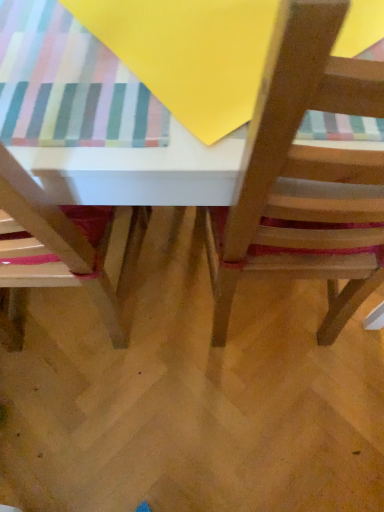
I want to click on wooden table at center, so click(306, 170).

This screenshot has height=512, width=384. What are the coordinates of `wooden chair at center, which is the first chair in right-to-left order` in the screenshot? It's located at (304, 176).

You are a GUI agent. You are given a task and a screenshot of the screen. Output one action in this format:
    pyautogui.click(x=<x>, y=<y>)
    Task: Click on the wooden chair at lower left, which appears as the 1th chair when viewed from the left
    The image size is (384, 512).
    Given the screenshot: What is the action you would take?
    pyautogui.click(x=61, y=246)

Locate an element on the screen. The height and width of the screenshot is (512, 384). wooden table at center is located at coordinates (306, 170).

Is wooden chair at lower left, which appears as the 1th chair when viewed from the left, inside wooden chair at center, which is the first chair in right-to-left order?

No, wooden chair at lower left, which appears as the 1th chair when viewed from the left, is not surrounded by wooden chair at center, which is the first chair in right-to-left order.

From the picture: Is wooden chair at center, which is the first chair in right-to-left order, oriented away from wooden chair at lower left, which appears as the 1th chair when viewed from the left?

No.

Can you confirm if wooden chair at center, which is the first chair in right-to-left order, is smaller than wooden chair at lower left, which is the second chair in right-to-left order?

No.

Which of these two, wooden table at center or wooden chair at center, which is the first chair in right-to-left order, stands shorter?

wooden table at center is shorter.

Is wooden table at center in front of or behind wooden chair at center, which is the first chair in right-to-left order, in the image?

In the image, wooden table at center appears behind wooden chair at center, which is the first chair in right-to-left order.

Consider the image. Is wooden table at center not within wooden chair at center, placed as the second chair when sorted from left to right?

Absolutely, wooden table at center is external to wooden chair at center, placed as the second chair when sorted from left to right.

Based on their sizes in the image, would you say wooden table at center is bigger or smaller than wooden chair at center, placed as the second chair when sorted from left to right?

Clearly, wooden table at center is larger in size than wooden chair at center, placed as the second chair when sorted from left to right.

Which object is closer to the camera taking this photo, wooden chair at center, placed as the second chair when sorted from left to right, or wooden table at center?

wooden chair at center, placed as the second chair when sorted from left to right, is closer to the camera.

From a real-world perspective, between wooden chair at center, which is the first chair in right-to-left order, and wooden table at center, who is vertically lower?

From a 3D spatial view, wooden table at center is below.

Considering the sizes of wooden chair at center, placed as the second chair when sorted from left to right, and wooden table at center in the image, is wooden chair at center, placed as the second chair when sorted from left to right, wider or thinner than wooden table at center?

Clearly, wooden chair at center, placed as the second chair when sorted from left to right, has less width compared to wooden table at center.

Is wooden chair at center, which is the first chair in right-to-left order, far away from wooden table at center?

That's not correct — wooden chair at center, which is the first chair in right-to-left order, is a little close to wooden table at center.

From the image's perspective, is wooden chair at lower left, which appears as the 1th chair when viewed from the left, above or below wooden chair at center, placed as the second chair when sorted from left to right?

wooden chair at lower left, which appears as the 1th chair when viewed from the left, is situated lower than wooden chair at center, placed as the second chair when sorted from left to right, in the image.

Is wooden chair at lower left, which is the second chair in right-to-left order, closer to the viewer compared to wooden chair at center, placed as the second chair when sorted from left to right?

No, wooden chair at lower left, which is the second chair in right-to-left order, is further to the viewer.

Considering the positions of points (8, 269) and (344, 270), is point (8, 269) farther from camera compared to point (344, 270)?

No, it is in front of (344, 270).

Looking at this image, between wooden chair at lower left, which is the second chair in right-to-left order, and wooden table at center, which one has larger width?

wooden table at center is wider.

From a real-world perspective, does wooden chair at lower left, which appears as the 1th chair when viewed from the left, stand above wooden table at center?

Yes, from a real-world perspective, wooden chair at lower left, which appears as the 1th chair when viewed from the left, is over wooden table at center

Who is bigger, wooden chair at lower left, which is the second chair in right-to-left order, or wooden table at center?

Bigger between the two is wooden table at center.

Does point (40, 193) appear closer or farther from the camera than point (377, 95)?

Clearly, point (40, 193) is more distant from the camera than point (377, 95).

How many degrees apart are the facing directions of wooden table at center and wooden chair at lower left, which appears as the 1th chair when viewed from the left?

0.000159 degrees.

Is wooden table at center smaller than wooden chair at lower left, which appears as the 1th chair when viewed from the left?

No, wooden table at center is not smaller than wooden chair at lower left, which appears as the 1th chair when viewed from the left.

Considering the sizes of wooden table at center and wooden chair at lower left, which appears as the 1th chair when viewed from the left, in the image, is wooden table at center wider or thinner than wooden chair at lower left, which appears as the 1th chair when viewed from the left,?

In the image, wooden table at center appears to be wider than wooden chair at lower left, which appears as the 1th chair when viewed from the left.

Consider the image. Would you say wooden table at center is inside or outside wooden chair at lower left, which appears as the 1th chair when viewed from the left?

wooden table at center is located beyond the bounds of wooden chair at lower left, which appears as the 1th chair when viewed from the left.

This screenshot has height=512, width=384. In order to click on chair that appears in front of the wooden chair at lower left, which is the second chair in right-to-left order in this screenshot , I will do `click(304, 176)`.

The height and width of the screenshot is (512, 384). What are the coordinates of `table directly beneath the wooden chair at center, placed as the second chair when sorted from left to right (from a real-world perspective)` in the screenshot? It's located at (306, 170).

Considering their positions, is wooden table at center positioned closer to wooden chair at center, which is the first chair in right-to-left order, than wooden chair at lower left, which appears as the 1th chair when viewed from the left?

wooden table at center is positioned closer to the anchor wooden chair at center, which is the first chair in right-to-left order.

Considering their positions, is wooden chair at lower left, which appears as the 1th chair when viewed from the left, positioned further to wooden table at center than wooden chair at center, which is the first chair in right-to-left order?

wooden chair at lower left, which appears as the 1th chair when viewed from the left, is further to wooden table at center.

When comparing their distances from wooden chair at center, which is the first chair in right-to-left order, does wooden chair at lower left, which is the second chair in right-to-left order, or wooden table at center seem further?

Among the two, wooden chair at lower left, which is the second chair in right-to-left order, is located further to wooden chair at center, which is the first chair in right-to-left order.

Which object lies further to the anchor point wooden chair at lower left, which appears as the 1th chair when viewed from the left, wooden table at center or wooden chair at center, placed as the second chair when sorted from left to right?

Among the two, wooden chair at center, placed as the second chair when sorted from left to right, is located further to wooden chair at lower left, which appears as the 1th chair when viewed from the left.

Considering their positions, is wooden chair at center, placed as the second chair when sorted from left to right, positioned further to wooden table at center than wooden chair at lower left, which is the second chair in right-to-left order?

Based on the image, wooden chair at lower left, which is the second chair in right-to-left order, appears to be further to wooden table at center.

Based on their spatial positions, is wooden chair at center, which is the first chair in right-to-left order, or wooden table at center closer to wooden chair at lower left, which is the second chair in right-to-left order?

Among the two, wooden table at center is located nearer to wooden chair at lower left, which is the second chair in right-to-left order.

You are a GUI agent. You are given a task and a screenshot of the screen. Output one action in this format:
    pyautogui.click(x=<x>, y=<y>)
    Task: Click on the table between wooden chair at lower left, which appears as the 1th chair when viewed from the left, and wooden chair at center, which is the first chair in right-to-left order, from left to right
    
    Given the screenshot: What is the action you would take?
    pyautogui.click(x=306, y=170)